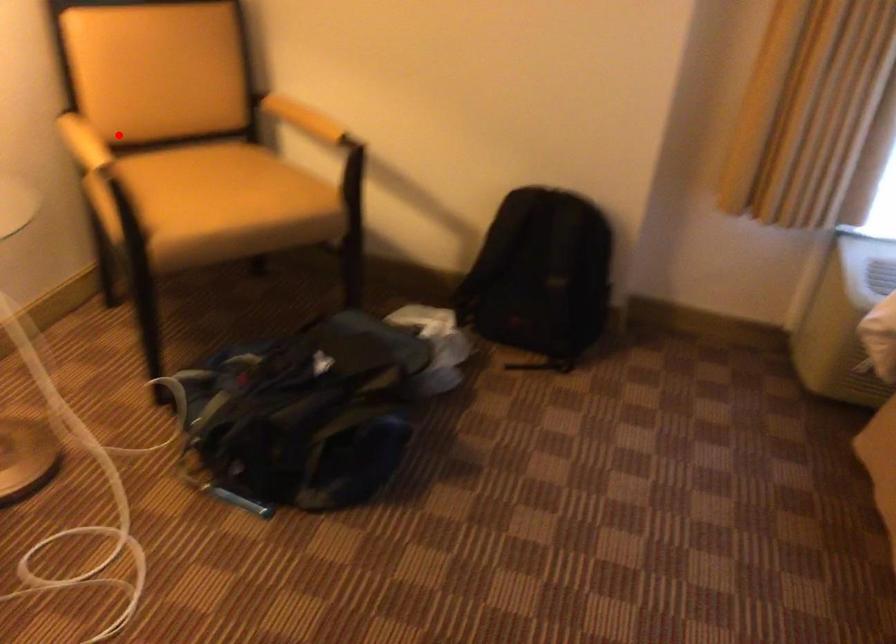
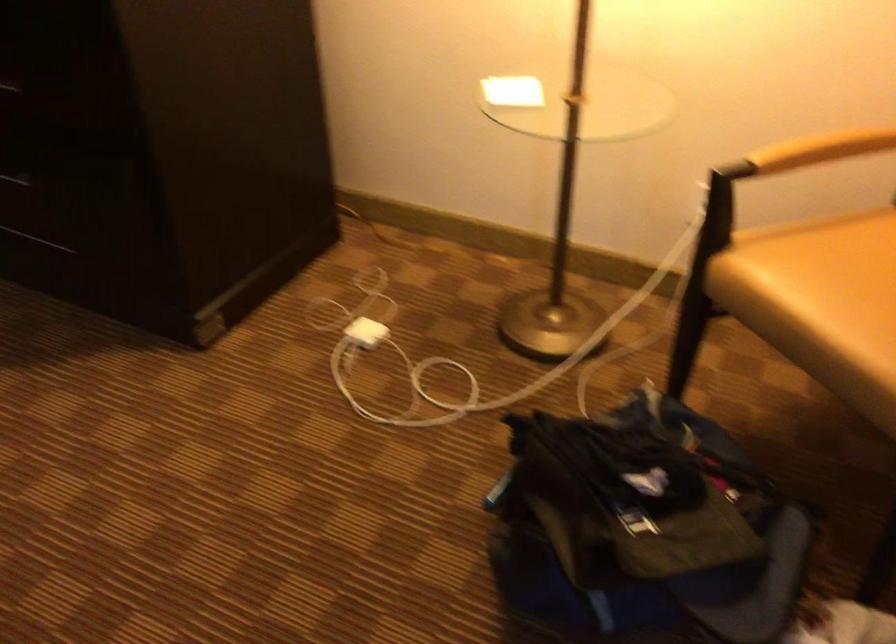
Question: I am providing you with two images of the same scene from different viewpoints. A red point is marked on the first image. Is the red point's position out of view in image 2?

Choices:
 (A) Yes
 (B) No

Answer: (B)